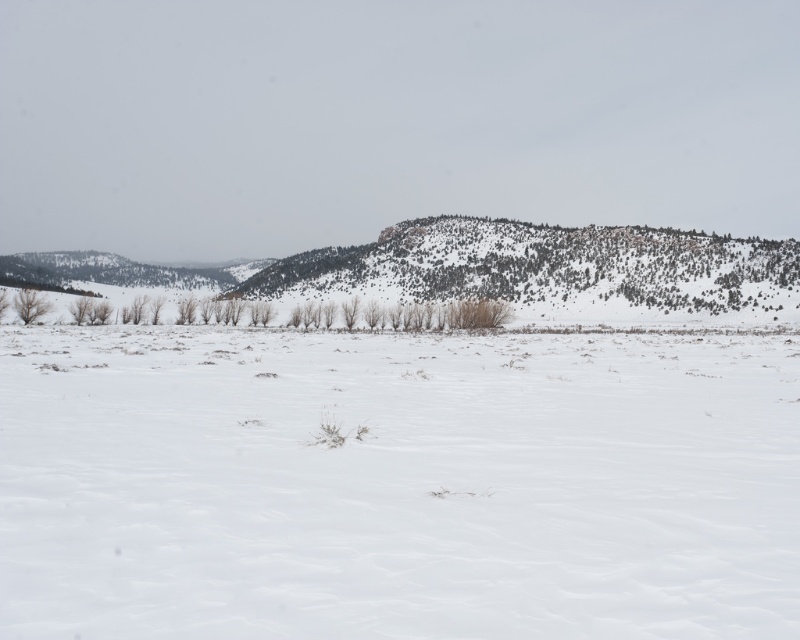
Question: Can you confirm if white fluffy snow at center is thinner than green textured hill at center?

Choices:
 (A) yes
 (B) no

Answer: (A)

Question: Does white fluffy snow at center appear under green textured hill at center?

Choices:
 (A) yes
 (B) no

Answer: (A)

Question: Which object appears farthest from the camera in this image?

Choices:
 (A) white fluffy snow at center
 (B) green textured hill at center

Answer: (B)

Question: Does white fluffy snow at center appear on the right side of green textured hill at center?

Choices:
 (A) no
 (B) yes

Answer: (A)